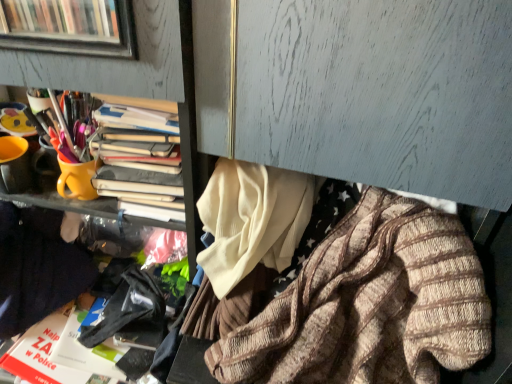
Question: Is knitted wool sweater at lower right, placed as the first clothing when sorted from right to left, at the right side of yellow matte cup at upper left?

Choices:
 (A) yes
 (B) no

Answer: (A)

Question: Considering the relative sizes of knitted wool sweater at lower right, which is counted as the 2th clothing, starting from the left, and yellow matte cup at upper left in the image provided, is knitted wool sweater at lower right, which is counted as the 2th clothing, starting from the left, shorter than yellow matte cup at upper left?

Choices:
 (A) no
 (B) yes

Answer: (A)

Question: Does knitted wool sweater at lower right, placed as the first clothing when sorted from right to left, have a smaller size compared to yellow matte cup at upper left?

Choices:
 (A) no
 (B) yes

Answer: (A)

Question: From a real-world perspective, is knitted wool sweater at lower right, placed as the first clothing when sorted from right to left, beneath yellow matte cup at upper left?

Choices:
 (A) yes
 (B) no

Answer: (A)

Question: Could you tell me if knitted wool sweater at lower right, placed as the first clothing when sorted from right to left, is turned towards yellow matte cup at upper left?

Choices:
 (A) no
 (B) yes

Answer: (A)

Question: Is dark blue sweater at left, acting as the second clothing starting from the right, shorter than knitted wool sweater at lower right, placed as the first clothing when sorted from right to left?

Choices:
 (A) yes
 (B) no

Answer: (A)

Question: Does dark blue sweater at left, which ranks as the first clothing in left-to-right order, come behind knitted wool sweater at lower right, which is counted as the 2th clothing, starting from the left?

Choices:
 (A) yes
 (B) no

Answer: (A)

Question: Could you tell me if dark blue sweater at left, which ranks as the first clothing in left-to-right order, is turned towards knitted wool sweater at lower right, which is counted as the 2th clothing, starting from the left?

Choices:
 (A) yes
 (B) no

Answer: (B)

Question: Is dark blue sweater at left, acting as the second clothing starting from the right, wider than knitted wool sweater at lower right, placed as the first clothing when sorted from right to left?

Choices:
 (A) yes
 (B) no

Answer: (B)

Question: Is dark blue sweater at left, acting as the second clothing starting from the right, oriented away from knitted wool sweater at lower right, placed as the first clothing when sorted from right to left?

Choices:
 (A) no
 (B) yes

Answer: (A)

Question: Does dark blue sweater at left, acting as the second clothing starting from the right, appear on the left side of knitted wool sweater at lower right, placed as the first clothing when sorted from right to left?

Choices:
 (A) no
 (B) yes

Answer: (B)

Question: Considering the relative sizes of yellow matte cup at upper left and knitted wool sweater at lower right, which is counted as the 2th clothing, starting from the left, in the image provided, is yellow matte cup at upper left taller than knitted wool sweater at lower right, which is counted as the 2th clothing, starting from the left,?

Choices:
 (A) no
 (B) yes

Answer: (A)